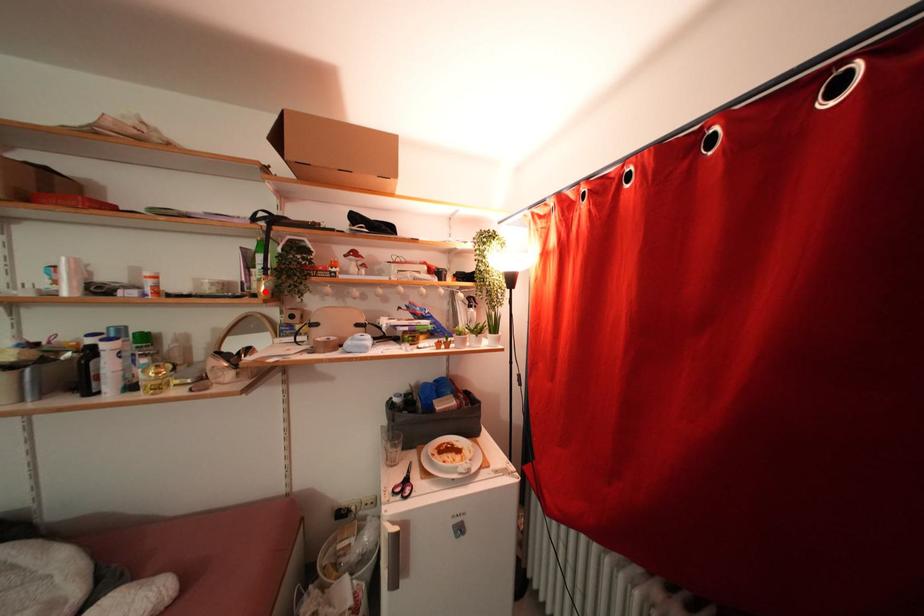
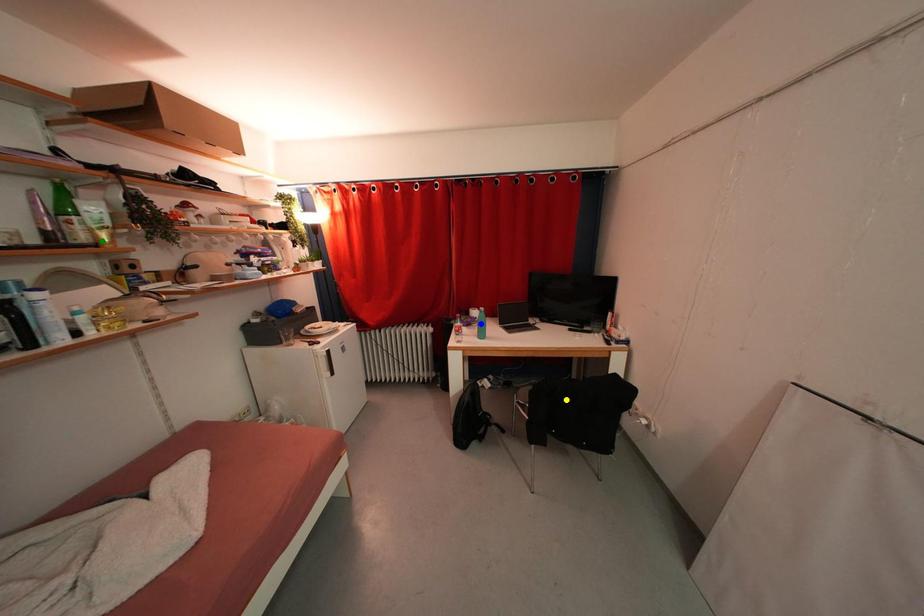
Question: I am providing you with two images of the same scene from different viewpoints. A red point is marked on the first image. You are given multiple points on the second image. Can you choose the point in image 2 that corresponds to the point in image 1?

Choices:
 (A) yellow point
 (B) blue point
 (C) green point

Answer: (C)